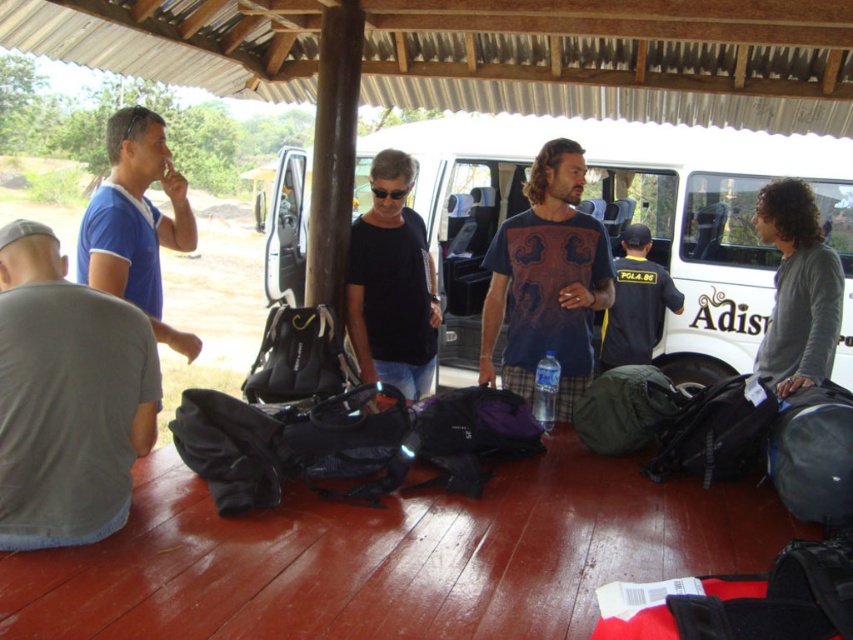
Does dark blue printed t-shirt at center have a greater height compared to dark blue uniform at center?

No, dark blue printed t-shirt at center is not taller than dark blue uniform at center.

Which is behind, point (578, 156) or point (619, 324)?

The point (619, 324) is more distant.

What are the coordinates of `dark blue printed t-shirt at center` in the screenshot? It's located at (546, 280).

Can you confirm if dark blue printed t-shirt at center is smaller than black matte shirt at center?

No, dark blue printed t-shirt at center is not smaller than black matte shirt at center.

The width and height of the screenshot is (853, 640). I want to click on dark blue printed t-shirt at center, so click(546, 280).

Find the location of `dark blue printed t-shirt at center`. dark blue printed t-shirt at center is located at coordinates (546, 280).

Find the location of `black matte shirt at center`. black matte shirt at center is located at coordinates (392, 284).

Does black matte shirt at center appear on the left side of dark blue uniform at center?

Yes, black matte shirt at center is to the left of dark blue uniform at center.

Does point (370, 253) come in front of point (647, 285)?

Yes.

Where is `black matte shirt at center`? black matte shirt at center is located at coordinates (392, 284).